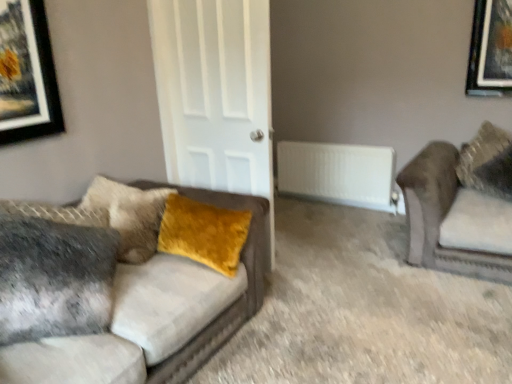
Question: From a real-world perspective, is velvet yellow pillow at upper right, the 1th pillow when ordered from back to front, on top of white plastic radiator at center?

Choices:
 (A) no
 (B) yes

Answer: (B)

Question: Is velvet yellow pillow at upper right, the second pillow positioned from the left, wider than white plastic radiator at center?

Choices:
 (A) yes
 (B) no

Answer: (A)

Question: Is velvet yellow pillow at upper right, the second pillow positioned from the left, to the right of white plastic radiator at center from the viewer's perspective?

Choices:
 (A) yes
 (B) no

Answer: (A)

Question: Is velvet yellow pillow at upper right, the 1th pillow when ordered from back to front, smaller than white plastic radiator at center?

Choices:
 (A) yes
 (B) no

Answer: (B)

Question: Does velvet yellow pillow at upper right, the 1th pillow viewed from the right, appear on the left side of white plastic radiator at center?

Choices:
 (A) yes
 (B) no

Answer: (B)

Question: Is velvet brown couch at right, the first studio couch in the right-to-left sequence, spatially inside white plastic radiator at center, or outside of it?

Choices:
 (A) outside
 (B) inside

Answer: (A)

Question: From the image's perspective, is velvet brown couch at right, the first studio couch in the right-to-left sequence, above or below white plastic radiator at center?

Choices:
 (A) below
 (B) above

Answer: (A)

Question: Based on their sizes in the image, would you say velvet brown couch at right, the first studio couch in the right-to-left sequence, is bigger or smaller than white plastic radiator at center?

Choices:
 (A) big
 (B) small

Answer: (A)

Question: From a real-world perspective, relative to white plastic radiator at center, is velvet brown couch at right, the first studio couch in the right-to-left sequence, vertically above or below?

Choices:
 (A) above
 (B) below

Answer: (A)

Question: Is white matte door at center in front of or behind velvet mustard pillow at left, the second pillow viewed from the back, in the image?

Choices:
 (A) behind
 (B) front

Answer: (A)

Question: Considering the positions of white matte door at center and velvet mustard pillow at left, the second pillow viewed from the back, in the image, is white matte door at center wider or thinner than velvet mustard pillow at left, the second pillow viewed from the back,?

Choices:
 (A) thin
 (B) wide

Answer: (A)

Question: Would you say white matte door at center is to the left or to the right of velvet mustard pillow at left, the second pillow positioned from the right, in the picture?

Choices:
 (A) right
 (B) left

Answer: (A)

Question: From the image's perspective, is white matte door at center above or below velvet mustard pillow at left, the second pillow positioned from the right?

Choices:
 (A) above
 (B) below

Answer: (A)

Question: From a real-world perspective, is white plastic radiator at center positioned above or below velvet brown couch at right, the first studio couch in the right-to-left sequence?

Choices:
 (A) below
 (B) above

Answer: (A)

Question: Relative to velvet brown couch at right, the first studio couch in the right-to-left sequence, is white plastic radiator at center in front or behind?

Choices:
 (A) behind
 (B) front

Answer: (A)